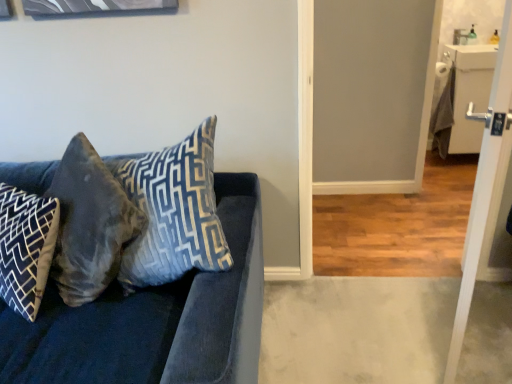
You are a GUI agent. You are given a task and a screenshot of the screen. Output one action in this format:
    pyautogui.click(x=<x>, y=<y>)
    Task: Click on the free space to the left of white glossy door at right
    
    Given the screenshot: What is the action you would take?
    pyautogui.click(x=357, y=328)